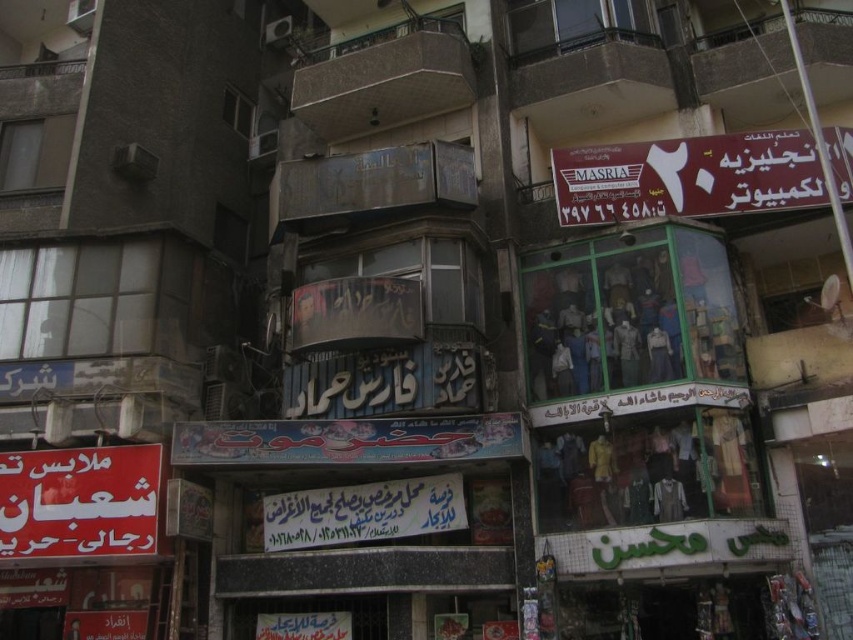
Question: Does maroon plastic signboard at upper right come in front of red fabric sign at lower left?

Choices:
 (A) no
 (B) yes

Answer: (B)

Question: Among these points, which one is nearest to the camera?

Choices:
 (A) (796, 192)
 (B) (122, 532)

Answer: (B)

Question: Which point is closer to the camera?

Choices:
 (A) pos(59,541)
 (B) pos(618,179)

Answer: (A)

Question: Does maroon plastic signboard at upper right appear under red fabric sign at lower left?

Choices:
 (A) no
 (B) yes

Answer: (A)

Question: Can you confirm if maroon plastic signboard at upper right is bigger than red fabric sign at lower left?

Choices:
 (A) yes
 (B) no

Answer: (A)